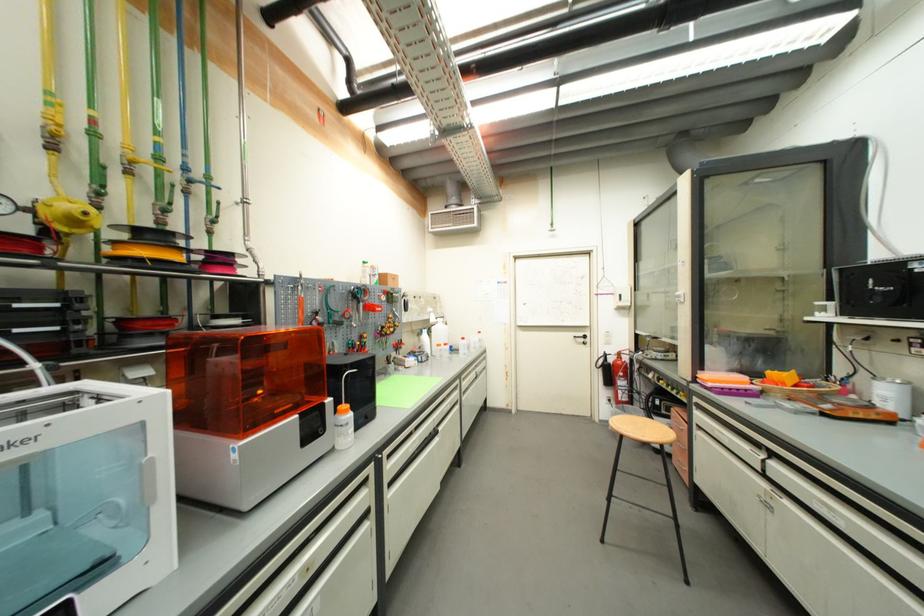
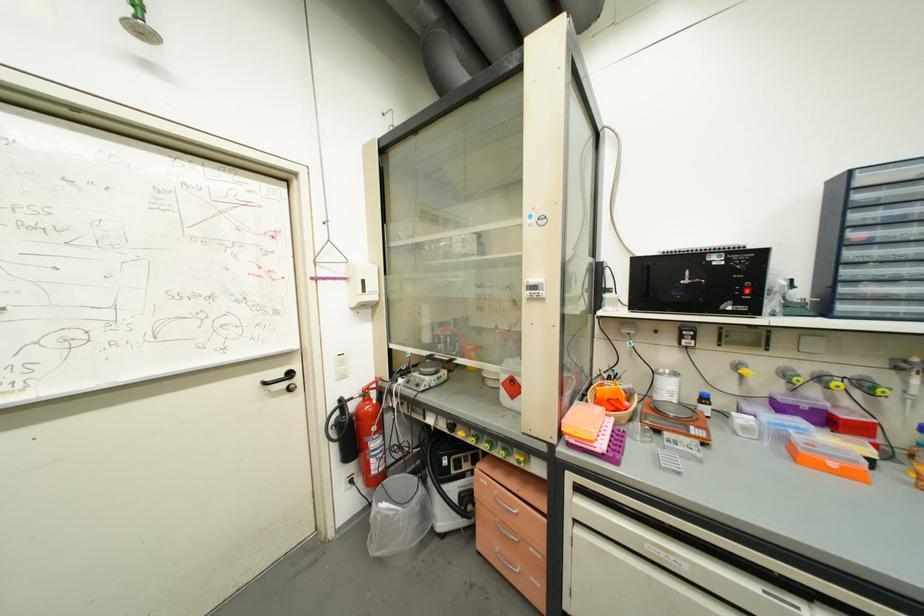
Find the pixel in the second image that matches point 626,297 in the first image.

(369, 283)